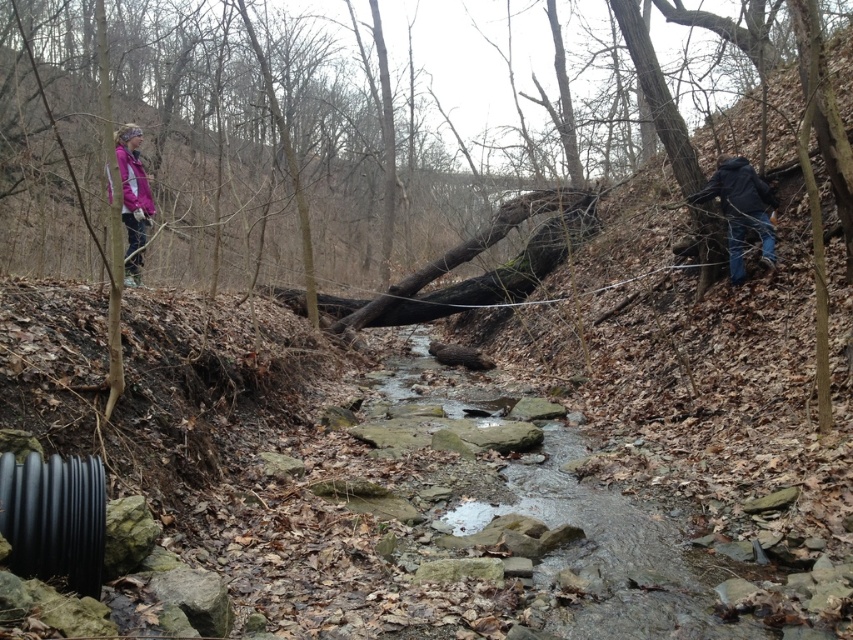
You are a hiker in the forest and you see the dark blue jeans at right. Where exactly are they located in this scene?

The dark blue jeans at right are located at point (740, 209) in the scene.

You are a hiker trying to locate two items of clothing belonging to a climber in the forest. The items are the dark blue jeans at right and the dark blue jacket at right. Based on their positions, which item is higher up from the ground?

The dark blue jeans at right is taller than the dark blue jacket at right, so the jeans are higher up from the ground.

You are navigating through a forest path and see the pink fleece jacket at upper left marked by point (x=132, y=198). Can you confirm if this point is located in the upper half of the image?

The pink fleece jacket at upper left is represented by point (x=132, y=198). Since the y coordinate is 0.157, which is less than 0.5, the point is in the upper half of the image.